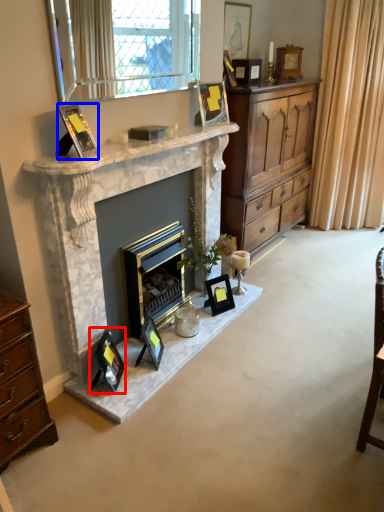
Question: Which object appears farthest to the camera in this image, picture frame (highlighted by a red box) or picture frame (highlighted by a blue box)?

Choices:
 (A) picture frame
 (B) picture frame

Answer: (A)